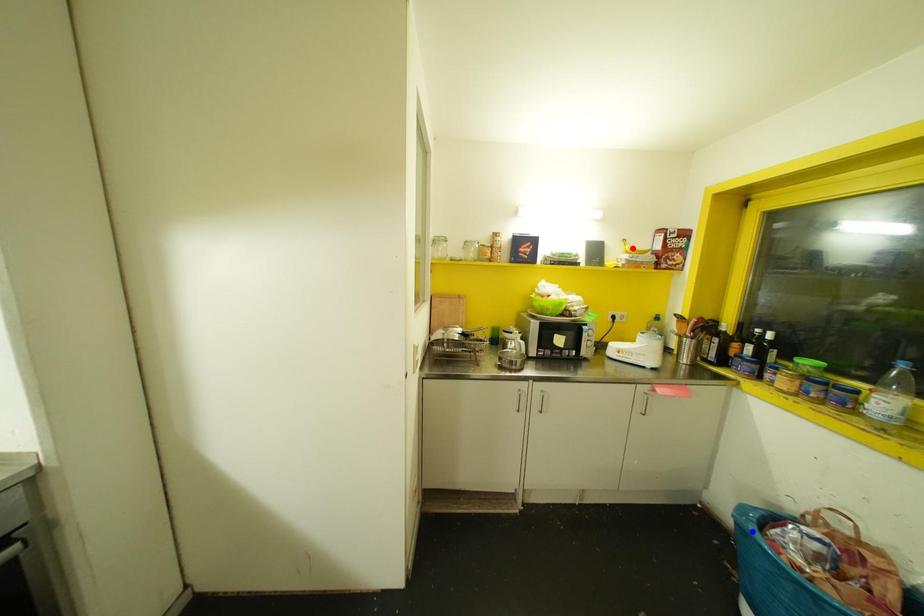
Question: Which of the two points in the image is closer to the camera?

Choices:
 (A) Blue point is closer.
 (B) Red point is closer.

Answer: (A)